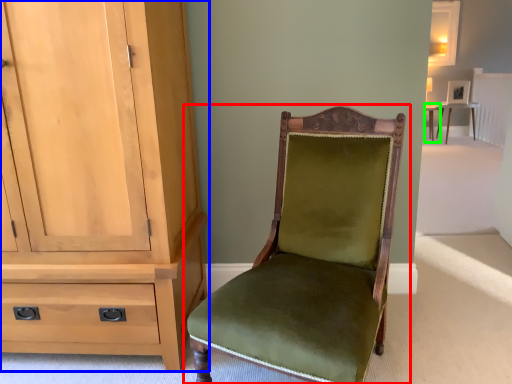
Question: Based on their relative distances, which object is nearer to chair (highlighted by a red box)? Choose from cabinetry (highlighted by a blue box) and table (highlighted by a green box).

Choices:
 (A) cabinetry
 (B) table

Answer: (A)